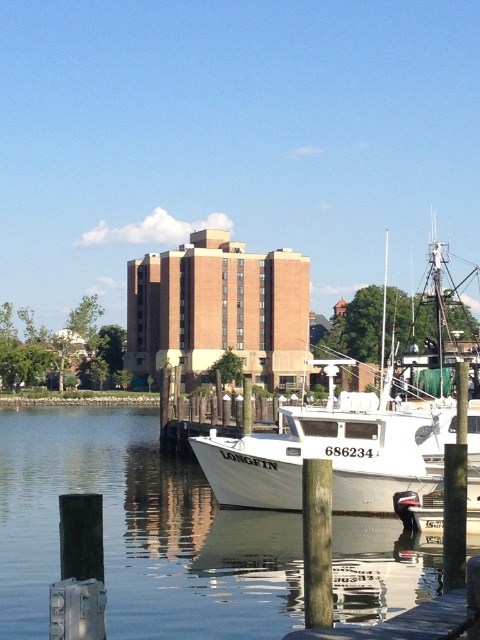
Which of these two, white matte boat at center or wooden at lower right, stands taller?

white matte boat at center

Which is in front, point (468, 436) or point (468, 614)?

Point (468, 614)

Does point (385, 465) come farther from viewer compared to point (372, 634)?

Yes, point (385, 465) is behind point (372, 634).

Where is `white matte boat at center`? This screenshot has height=640, width=480. white matte boat at center is located at coordinates (333, 452).

Who is more forward, (146, 493) or (437, 628)?

Positioned in front is point (437, 628).

Is point (251, 628) farther from viewer compared to point (440, 608)?

That is True.

Where is `clear water at lower center`? clear water at lower center is located at coordinates [139, 532].

Can you confirm if clear water at lower center is positioned to the left of white matte boat at center?

Indeed, clear water at lower center is positioned on the left side of white matte boat at center.

What do you see at coordinates (139, 532) in the screenshot? The image size is (480, 640). I see `clear water at lower center` at bounding box center [139, 532].

Locate an element on the screen. The image size is (480, 640). clear water at lower center is located at coordinates (139, 532).